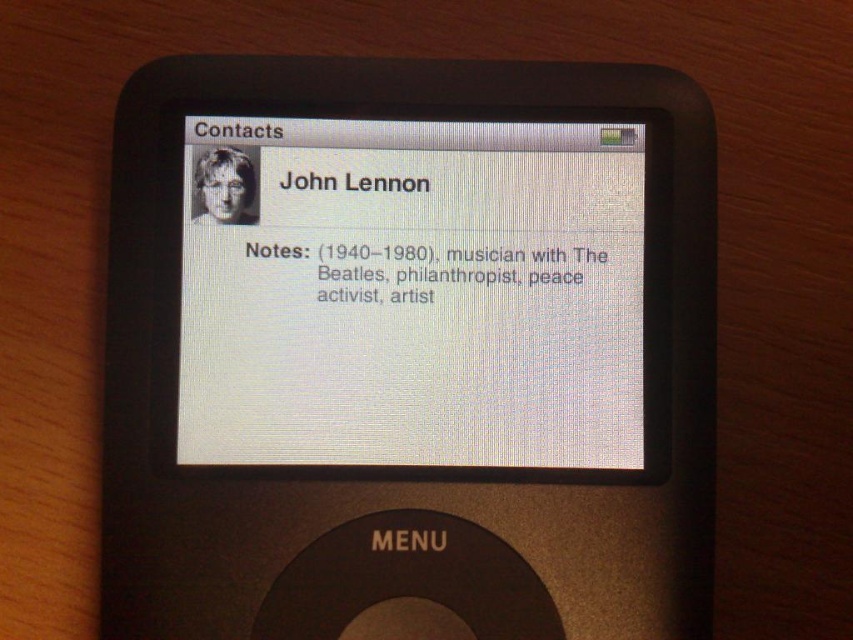
Looking at the iPod Classic on the wooden surface, you notice the white matte screen at center and the white matte text at center. Which of these two elements is located to the left?

The white matte screen at center is positioned on the left side of the white matte text at center.

You are holding a black plastic ipod at center and want to see the white matte text at center displayed on it. Is the text visible from your current position?

The black plastic ipod at center is closer to the viewer than the white matte text at center, so the text is visible from your current position.

You are holding a black plastic ipod at center and want to read the black matte text at center on its screen. Can you see the text clearly?

The black plastic ipod at center is closer to the viewer than the black matte text at center, so the text might be difficult to see clearly because it is farther away.